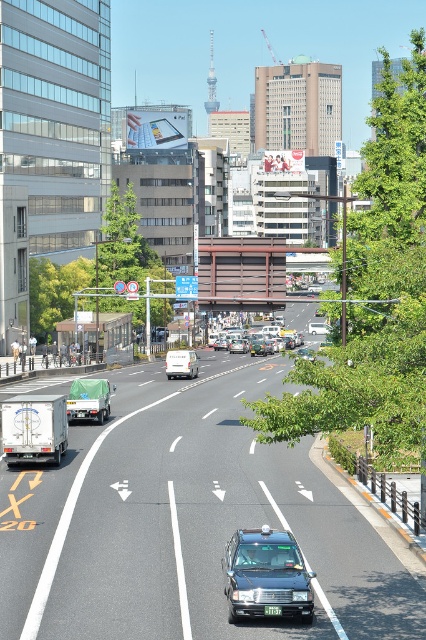
Is point (232, 536) positioned before point (187, 371)?

Yes, point (232, 536) is in front of point (187, 371).

Can you confirm if shiny black sedan at center is bigger than white matte van at center?

Actually, shiny black sedan at center might be smaller than white matte van at center.

Is point (287, 573) closer to camera compared to point (193, 376)?

Yes, point (287, 573) is in front of point (193, 376).

This screenshot has height=640, width=426. In order to click on shiny black sedan at center in this screenshot , I will do `click(265, 573)`.

Who is taller, metallic silver sedan at center or green plastic license plate at center?

With more height is metallic silver sedan at center.

Who is more forward, (267, 337) or (268, 612)?

Point (268, 612) is in front.

The height and width of the screenshot is (640, 426). What are the coordinates of `metallic silver sedan at center` in the screenshot? It's located at (256, 340).

Which is in front, point (327, 326) or point (270, 605)?

Point (270, 605) is more forward.

This screenshot has width=426, height=640. In order to click on black glossy sedan at center in this screenshot , I will do `click(317, 326)`.